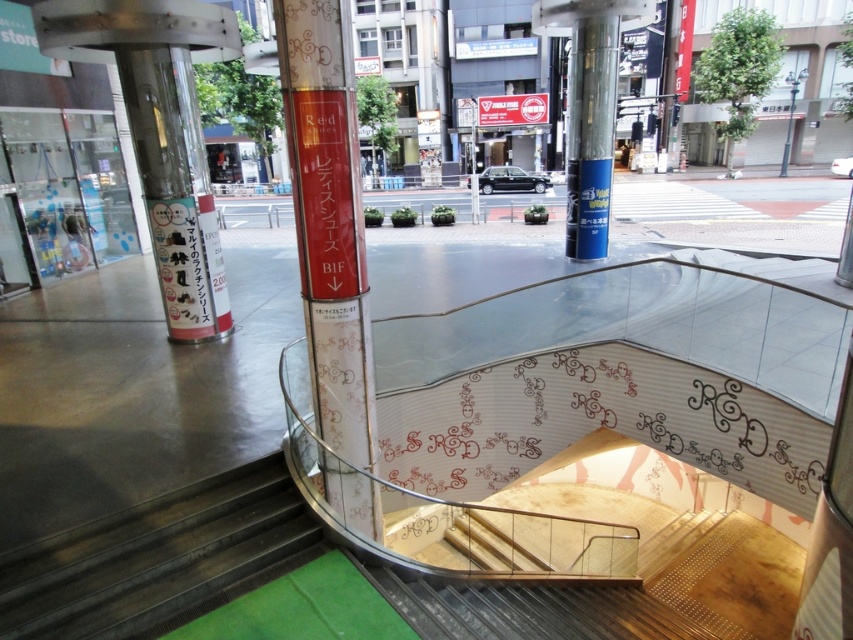
You are a delivery person carrying a package that requires a clear path of at least 8 meters between the matte pink column at center and the blue glossy pillar at center. Can you safely navigate through this area?

The distance between the matte pink column at center and the blue glossy pillar at center is 7.52 meters, which is less than the required 8 meters. Therefore, you cannot safely navigate through this area with the package.

From the picture: You are standing at the entrance of the building and want to locate the glass door with reflections of the street outside. Based on the coordinates provided, is the point at (328, 220) on the glass door or on the matte pink column at center?

The point at (328, 220) is on the matte pink column at center, not the glass door with reflections of the street outside.

You are an architect designing a new building and want to ensure that the matte pink column at center and the metallic silver pillar at left are placed in a way that allows for proper structural support. Given their current positions, which column is directly above the other?

The matte pink column at center is positioned under the metallic silver pillar at left, meaning the metallic silver pillar at left is directly above the matte pink column at center.